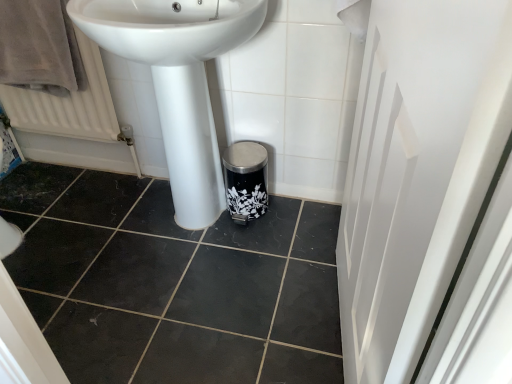
Question: From a real-world perspective, is brown velvety bath towel at upper left under white textured radiator at left?

Choices:
 (A) no
 (B) yes

Answer: (A)

Question: Is brown velvety bath towel at upper left turned away from white textured radiator at left?

Choices:
 (A) yes
 (B) no

Answer: (A)

Question: Is brown velvety bath towel at upper left positioned beyond the bounds of white textured radiator at left?

Choices:
 (A) no
 (B) yes

Answer: (B)

Question: Does brown velvety bath towel at upper left have a larger size compared to white textured radiator at left?

Choices:
 (A) yes
 (B) no

Answer: (A)

Question: Is brown velvety bath towel at upper left closer to camera compared to white textured radiator at left?

Choices:
 (A) no
 (B) yes

Answer: (B)

Question: Is the position of brown velvety bath towel at upper left more distant than that of white textured radiator at left?

Choices:
 (A) no
 (B) yes

Answer: (A)

Question: Is white glossy sink at center turned away from brown velvety bath towel at upper left?

Choices:
 (A) no
 (B) yes

Answer: (A)

Question: Considering the relative positions of white glossy sink at center and brown velvety bath towel at upper left in the image provided, is white glossy sink at center behind brown velvety bath towel at upper left?

Choices:
 (A) yes
 (B) no

Answer: (B)

Question: Is white glossy sink at center closer to the viewer compared to brown velvety bath towel at upper left?

Choices:
 (A) yes
 (B) no

Answer: (A)

Question: Is brown velvety bath towel at upper left located within white glossy sink at center?

Choices:
 (A) no
 (B) yes

Answer: (A)

Question: Are white glossy sink at center and brown velvety bath towel at upper left far apart?

Choices:
 (A) no
 (B) yes

Answer: (A)

Question: Can you confirm if white glossy sink at center is smaller than brown velvety bath towel at upper left?

Choices:
 (A) no
 (B) yes

Answer: (A)

Question: From the image's perspective, does white glossy screen door at right appear higher than white glossy sink at center?

Choices:
 (A) no
 (B) yes

Answer: (A)